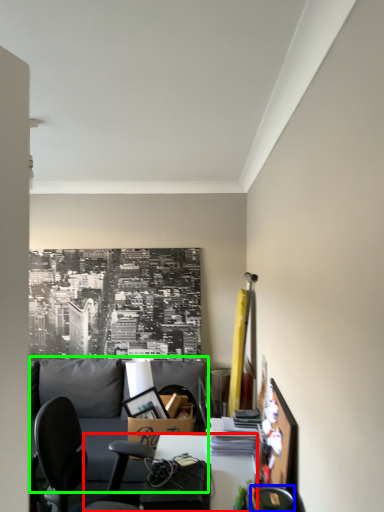
Question: Which object is positioned farthest from desk (highlighted by a red box)? Select from chair (highlighted by a blue box) and couch (highlighted by a green box).

Choices:
 (A) chair
 (B) couch

Answer: (B)